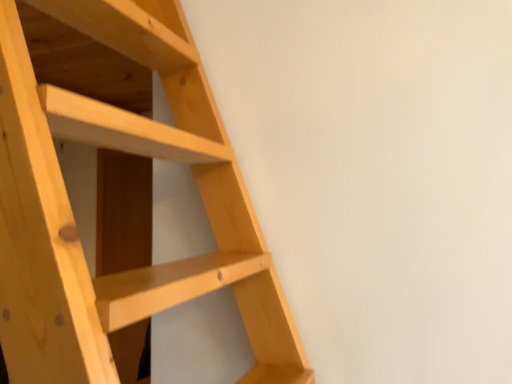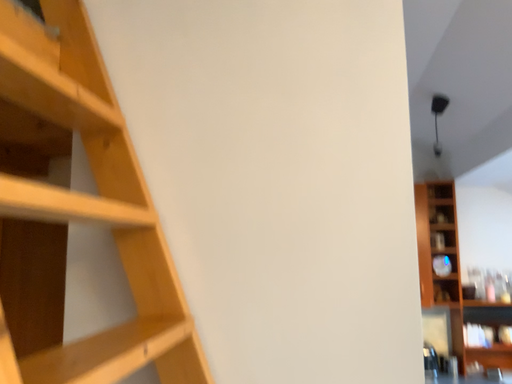
Question: How did the camera likely rotate when shooting the video?

Choices:
 (A) rotated right
 (B) rotated left

Answer: (A)